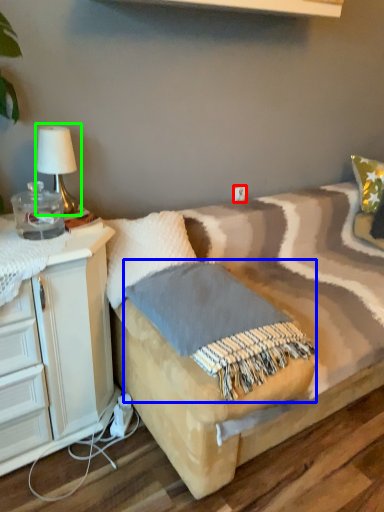
Question: Estimate the real-world distances between objects in this image. Which object is closer to electric outlet (highlighted by a red box), blanket (highlighted by a blue box) or table lamp (highlighted by a green box)?

Choices:
 (A) blanket
 (B) table lamp

Answer: (B)